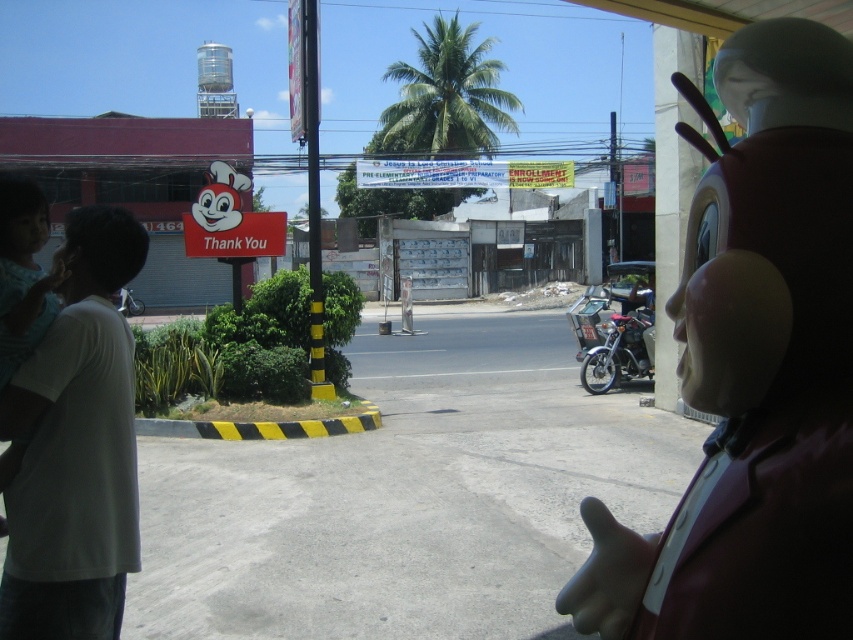
Question: Based on their relative distances, which object is farther from the smooth brown statue at right?

Choices:
 (A) white cotton shirt at left
 (B) metallic silver motorcycle at right

Answer: (B)

Question: Is smooth brown statue at right bigger than metallic silver motorcycle at right?

Choices:
 (A) yes
 (B) no

Answer: (B)

Question: Which object appears closest to the camera in this image?

Choices:
 (A) metallic silver motorcycle at right
 (B) smooth brown statue at right

Answer: (B)

Question: Does smooth brown statue at right appear over metallic silver motorcycle at right?

Choices:
 (A) yes
 (B) no

Answer: (A)

Question: Can you confirm if smooth brown statue at right is positioned to the right of white cotton shirt at left?

Choices:
 (A) no
 (B) yes

Answer: (B)

Question: Which point is farther from the camera taking this photo?

Choices:
 (A) (77, 307)
 (B) (604, 332)

Answer: (B)